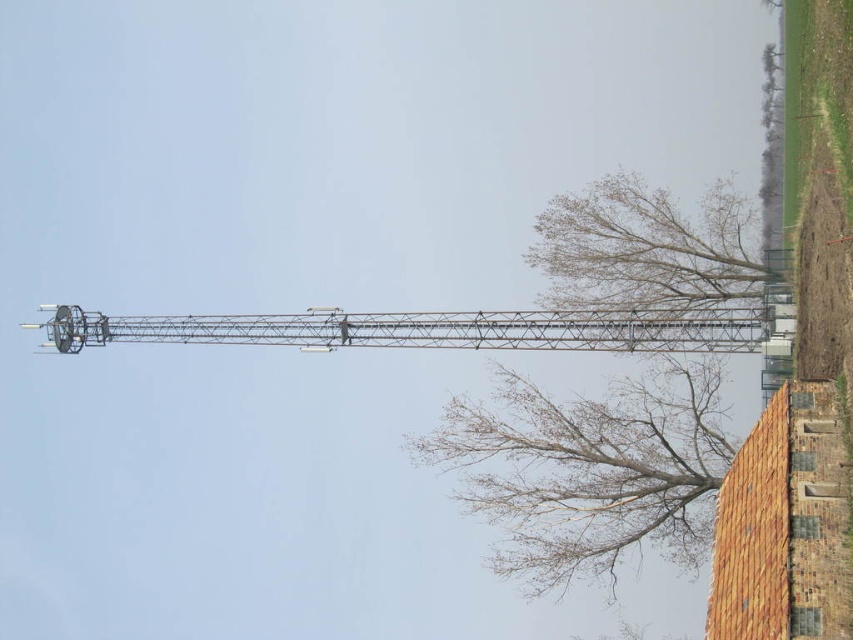
Question: Can you confirm if metallic gray crane at center is positioned to the left of metallic lift at center?

Choices:
 (A) yes
 (B) no

Answer: (A)

Question: Among these objects, which one is nearest to the camera?

Choices:
 (A) bare branches at upper right
 (B) metallic lift at center
 (C) bare branches at lower right
 (D) metallic gray crane at center

Answer: (D)

Question: From the image, what is the correct spatial relationship of metallic gray crane at center in relation to metallic lift at center?

Choices:
 (A) below
 (B) above

Answer: (B)

Question: Which point appears farthest from the camera in this image?

Choices:
 (A) (322, 346)
 (B) (135, 337)

Answer: (B)

Question: Is bare branches at lower right further to camera compared to bare branches at upper right?

Choices:
 (A) no
 (B) yes

Answer: (B)

Question: Which object is positioned closest to the metallic gray crane at center?

Choices:
 (A) metallic lift at center
 (B) bare branches at lower right
 (C) bare branches at upper right

Answer: (A)